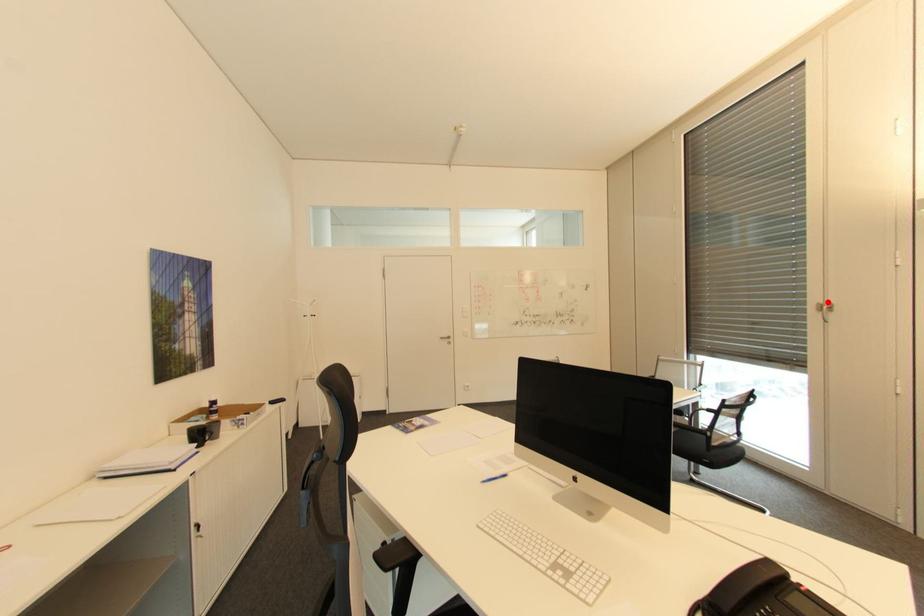
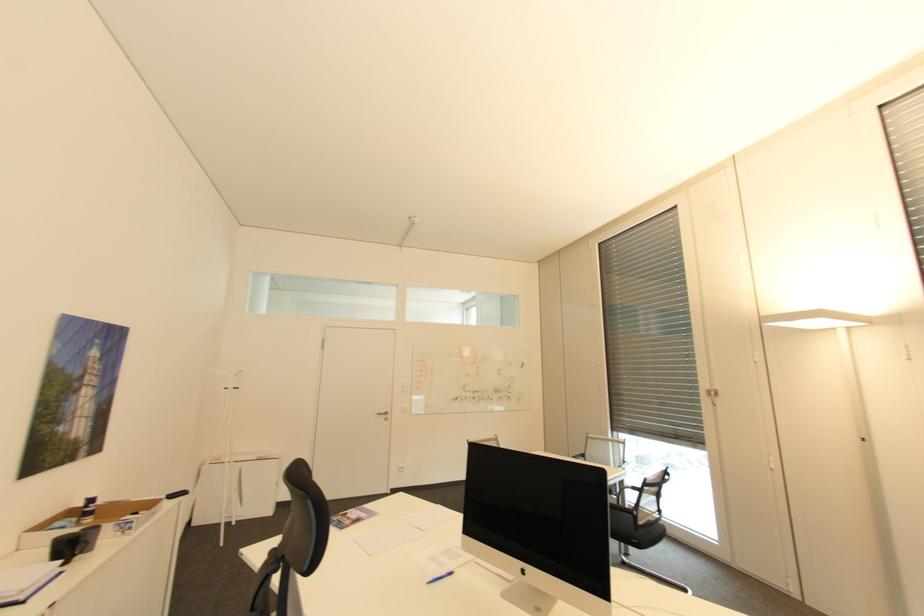
Where in the second image is the point corresponding to the highlighted location from the first image?

(713, 387)